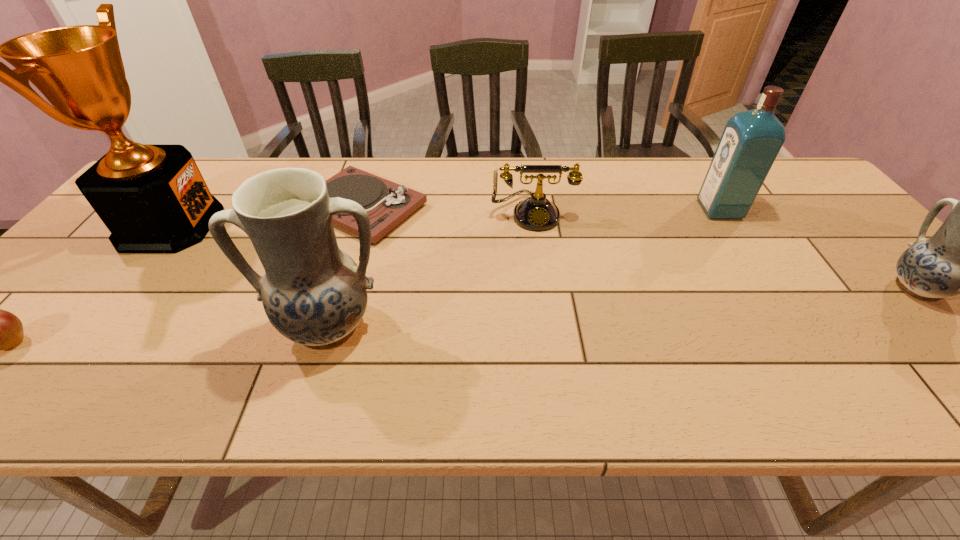
Where is `spot to insert another pottery for uniform distribution`? spot to insert another pottery for uniform distribution is located at coordinates (634, 307).